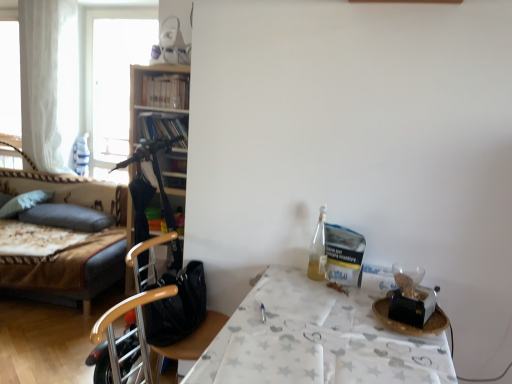
Question: Can you confirm if soft gray pillow at left, the first pillow viewed from the left, is wider than dark gray fabric pillow at left, positioned as the 2th pillow in left-to-right order?

Choices:
 (A) yes
 (B) no

Answer: (A)

Question: Can you confirm if soft gray pillow at left, the first pillow viewed from the left, is taller than dark gray fabric pillow at left, the 1th pillow when ordered from right to left?

Choices:
 (A) yes
 (B) no

Answer: (A)

Question: From the image's perspective, does soft gray pillow at left, acting as the 2th pillow starting from the right, appear lower than dark gray fabric pillow at left, the 1th pillow when ordered from right to left?

Choices:
 (A) yes
 (B) no

Answer: (B)

Question: From a real-world perspective, is soft gray pillow at left, the first pillow viewed from the left, positioned under dark gray fabric pillow at left, positioned as the 2th pillow in left-to-right order, based on gravity?

Choices:
 (A) no
 (B) yes

Answer: (A)

Question: Can you confirm if soft gray pillow at left, the first pillow viewed from the left, is shorter than dark gray fabric pillow at left, the 1th pillow when ordered from right to left?

Choices:
 (A) yes
 (B) no

Answer: (B)

Question: Is soft gray pillow at left, the first pillow viewed from the left, oriented away from dark gray fabric pillow at left, the 1th pillow when ordered from right to left?

Choices:
 (A) no
 (B) yes

Answer: (A)

Question: Considering the relative sizes of dark gray fabric pillow at left, the 1th pillow when ordered from right to left, and white sheer curtain at left in the image provided, is dark gray fabric pillow at left, the 1th pillow when ordered from right to left, thinner than white sheer curtain at left?

Choices:
 (A) no
 (B) yes

Answer: (A)

Question: From the image's perspective, is dark gray fabric pillow at left, positioned as the 2th pillow in left-to-right order, located above white sheer curtain at left?

Choices:
 (A) yes
 (B) no

Answer: (B)

Question: From a real-world perspective, is dark gray fabric pillow at left, the 1th pillow when ordered from right to left, below white sheer curtain at left?

Choices:
 (A) yes
 (B) no

Answer: (A)

Question: Is dark gray fabric pillow at left, the 1th pillow when ordered from right to left, bigger than white sheer curtain at left?

Choices:
 (A) no
 (B) yes

Answer: (A)

Question: Does dark gray fabric pillow at left, positioned as the 2th pillow in left-to-right order, appear on the right side of white sheer curtain at left?

Choices:
 (A) no
 (B) yes

Answer: (B)

Question: Is dark gray fabric pillow at left, the 1th pillow when ordered from right to left, further to camera compared to white sheer curtain at left?

Choices:
 (A) yes
 (B) no

Answer: (B)

Question: Is dark gray fabric pillow at left, positioned as the 2th pillow in left-to-right order, at the right side of white paper table at right?

Choices:
 (A) no
 (B) yes

Answer: (A)